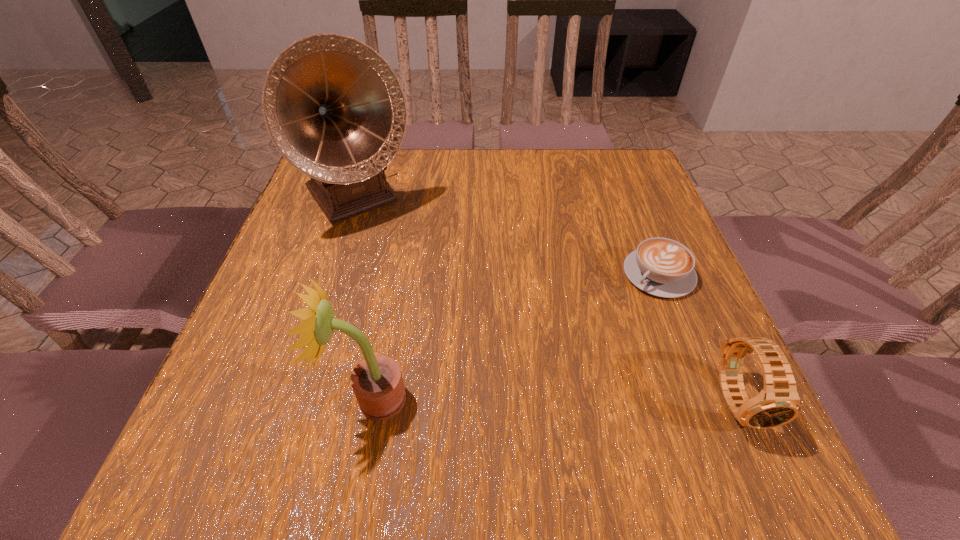
Locate an element on the screen. The width and height of the screenshot is (960, 540). sunflower is located at coordinates (377, 382).

Locate an element on the screen. The width and height of the screenshot is (960, 540). the third tallest object is located at coordinates (778, 403).

Locate an element on the screen. The height and width of the screenshot is (540, 960). cappuccino is located at coordinates (662, 267).

In order to click on the second farthest object in this screenshot , I will do `click(662, 267)`.

This screenshot has width=960, height=540. What are the coordinates of `phonograph record` in the screenshot? It's located at (335, 110).

Find the location of `the farthest object`. the farthest object is located at coordinates (335, 110).

The width and height of the screenshot is (960, 540). Identify the location of free space located on the face of the sunflower. (302, 399).

This screenshot has height=540, width=960. What are the coordinates of `vacant space located 0.140m on the face of the sunflower` in the screenshot? It's located at (254, 399).

In order to click on vacant space located 0.090m on the face of the sunflower in this screenshot , I will do tap(285, 399).

Where is `vacant space situated 0.290m on the side of the shortest object with the handle`? Image resolution: width=960 pixels, height=540 pixels. vacant space situated 0.290m on the side of the shortest object with the handle is located at coordinates (546, 376).